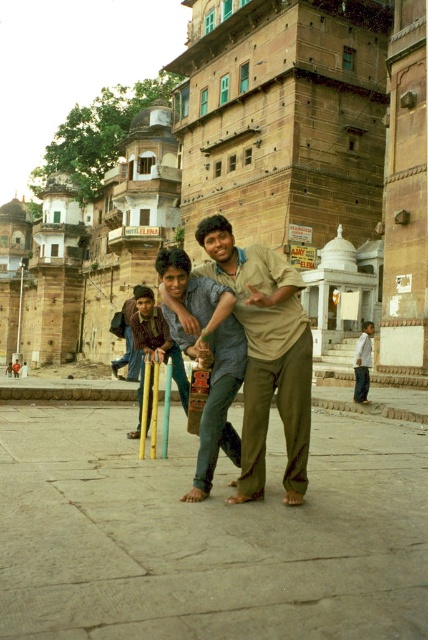
You are a photographer trying to capture a clear shot of the wooden cricket bats at center and the blue denim jeans at center. Which object should you focus on first to ensure both are in focus?

You should focus on the wooden cricket bats at center first because they are in front of the blue denim jeans at center, so focusing on the closer object will keep both in focus.

You are a delivery robot with a 1.2 meter wide package. You need to navigate through the street scene to deliver the package. The wooden cricket bats at center and blue denim jeans at center are in your path. Can you pass between them without moving the objects?

The distance between wooden cricket bats at center and blue denim jeans at center is 8.37 meters, which is wider than the 1.2 meter wide package. Therefore, the delivery robot can pass between them without moving the objects.

You are a tailor observing two shirts in the image. The brown cotton shirt at center and the white cotton shirt at lower right. Which shirt has a narrower width?

The brown cotton shirt at center is thinner than the white cotton shirt at lower right, so the brown cotton shirt at center has a narrower width.